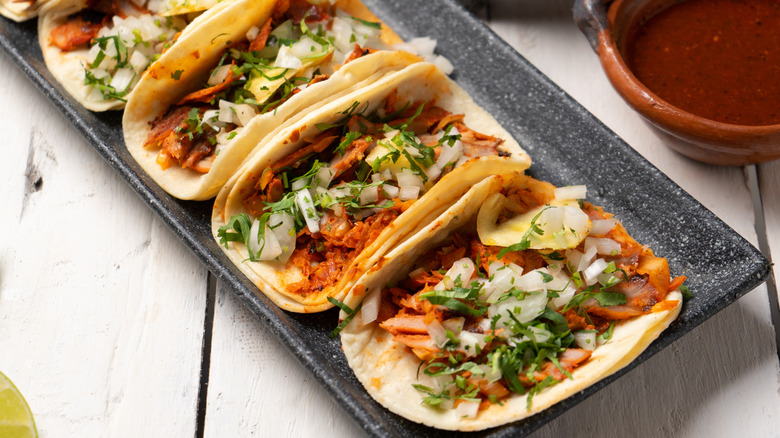
Image resolution: width=780 pixels, height=438 pixels. I want to click on rim of bowl for salsa, so click(x=676, y=119), click(x=605, y=45), click(x=759, y=132).